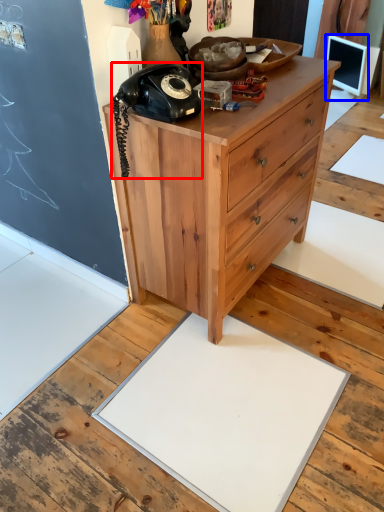
Question: Which point is further to the camera, corded phone (highlighted by a red box) or computer monitor (highlighted by a blue box)?

Choices:
 (A) corded phone
 (B) computer monitor

Answer: (B)